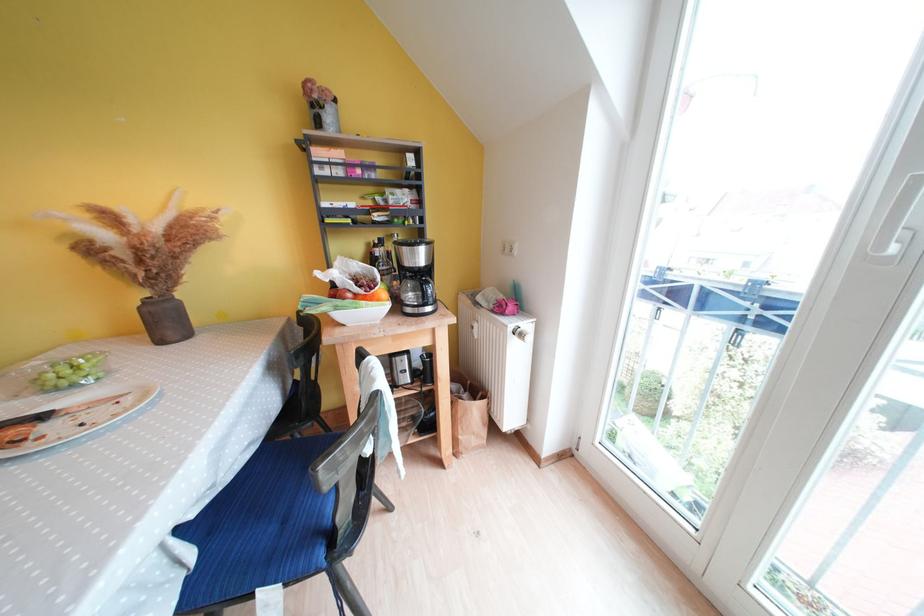
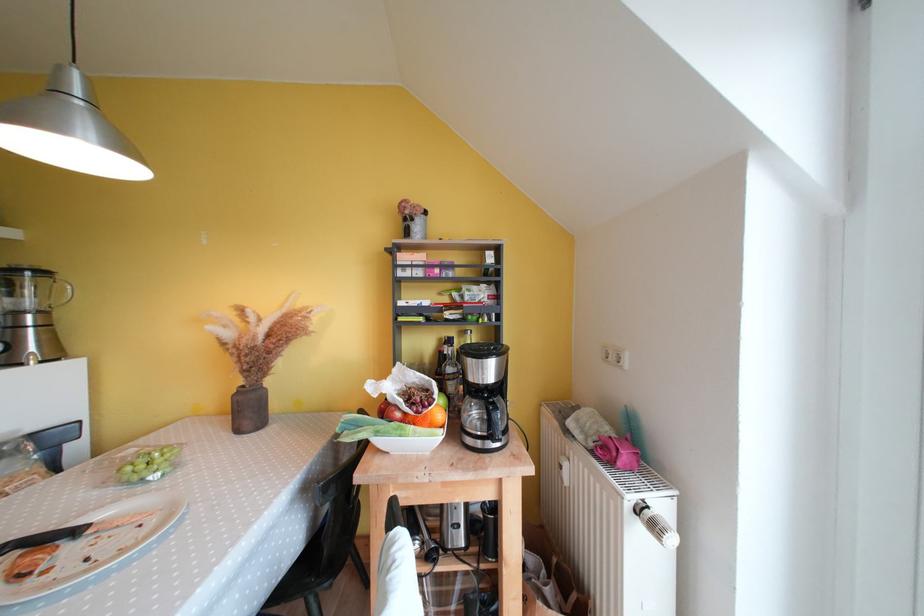
The point at (x=426, y=262) is marked in the first image. Where is the corresponding point in the second image?

(494, 376)